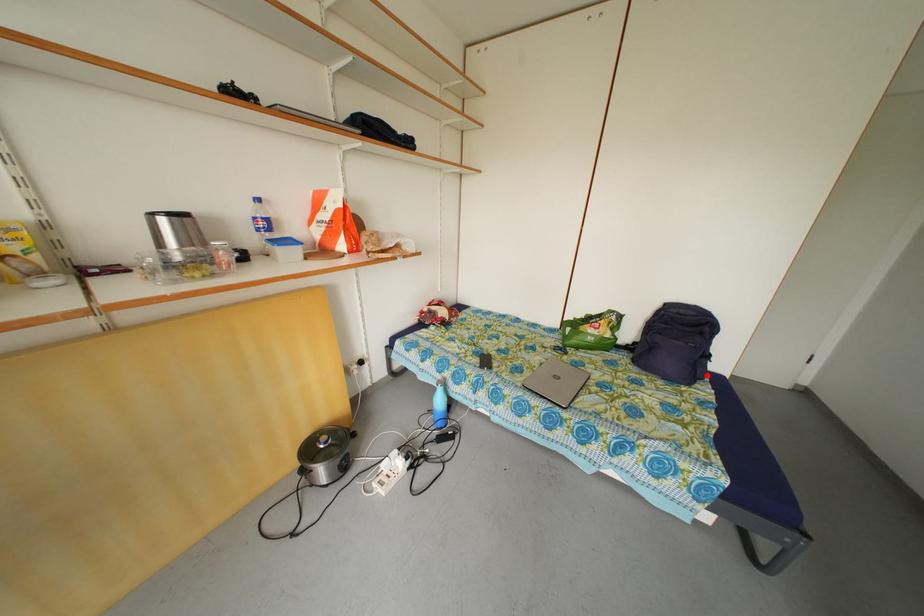
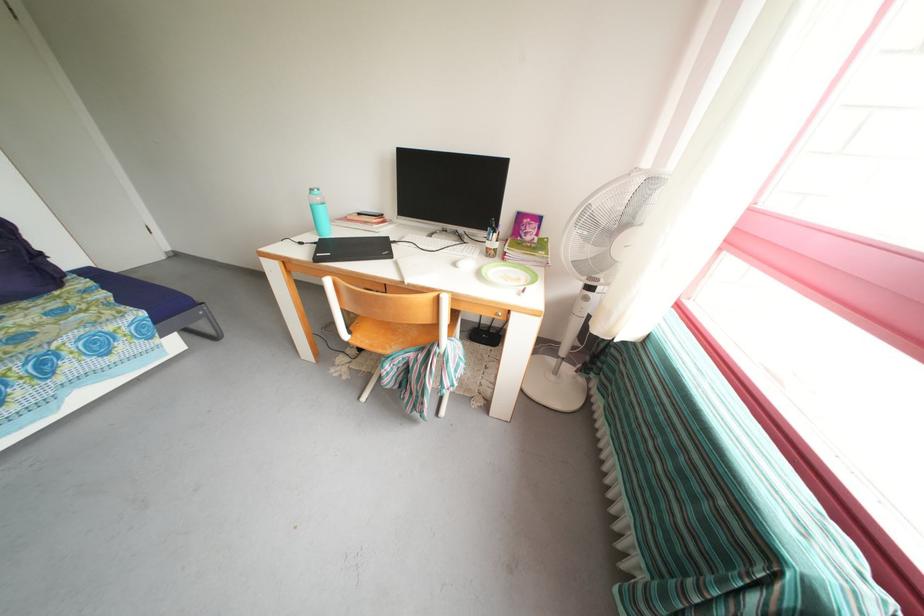
Question: I am providing you with two images of the same scene from different viewpoints. Image1 has a red point marked. In image2, the corresponding 3D location appears at what relative position? Reply with the corresponding letter.

Choices:
 (A) Closer
 (B) Farther

Answer: (B)